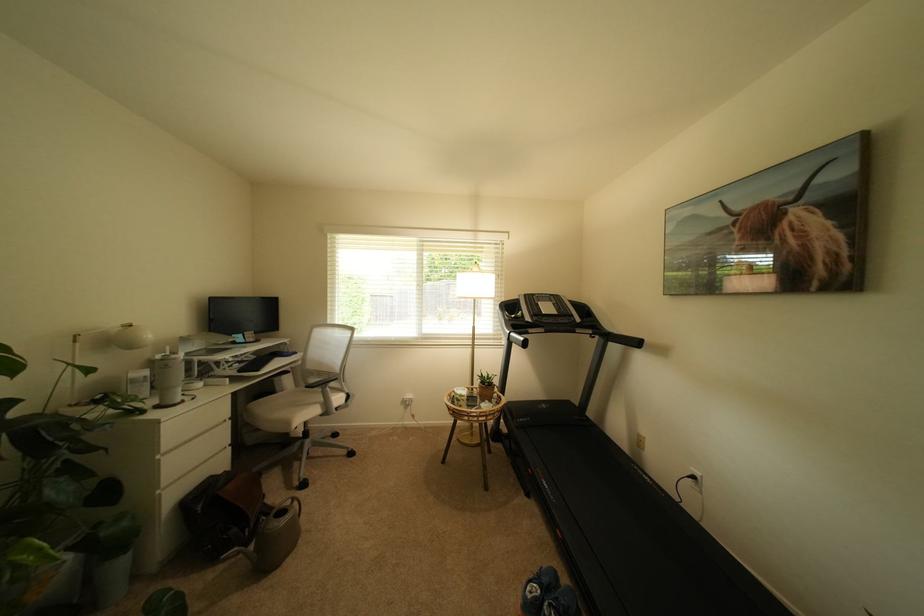
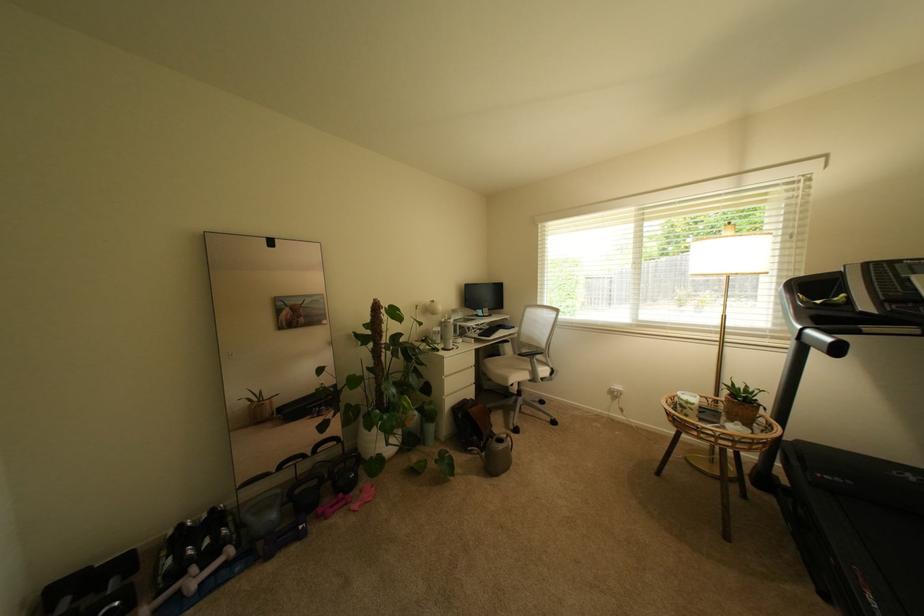
Find the pixel in the second image that matches point 521,317 in the first image.

(827, 302)